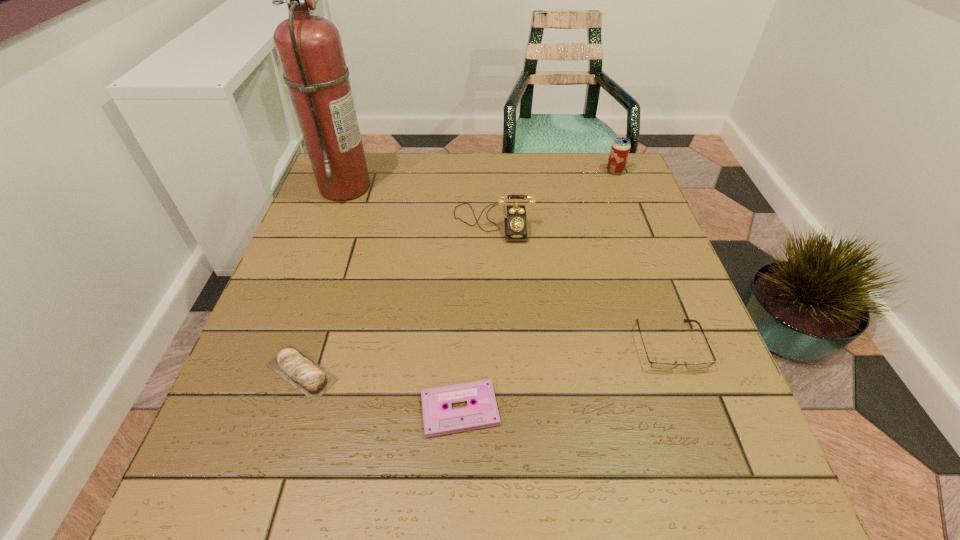
Locate an element on the screen. Image resolution: width=960 pixels, height=540 pixels. vacant space located 0.200m on the front-facing side of the spectacles is located at coordinates (719, 483).

You are a GUI agent. You are given a task and a screenshot of the screen. Output one action in this format:
    pyautogui.click(x=<x>, y=<y>)
    Task: Click on the vacant space located 0.350m on the right of the videotape
    This screenshot has height=540, width=960.
    Given the screenshot: What is the action you would take?
    pyautogui.click(x=697, y=409)

I want to click on fire extinguisher situated at the far edge, so click(x=309, y=47).

I want to click on beer can that is at the far edge, so click(620, 148).

At what (x,y) coordinates should I click in order to perform the action: click on fire extinguisher located at the left edge. Please return your answer as a coordinate pair (x, y). The image size is (960, 540). Looking at the image, I should click on 309,47.

This screenshot has width=960, height=540. Identify the location of pita bread at the left edge. (306, 375).

The height and width of the screenshot is (540, 960). Find the location of `beer can that is at the right edge`. beer can that is at the right edge is located at coordinates click(620, 148).

Locate an element on the screen. spectacles present at the right edge is located at coordinates (657, 365).

At what (x,y) coordinates should I click in order to perform the action: click on object present at the far left corner. Please return your answer as a coordinate pair (x, y). Looking at the image, I should click on (309, 47).

Identify the location of object present at the far right corner. (620, 148).